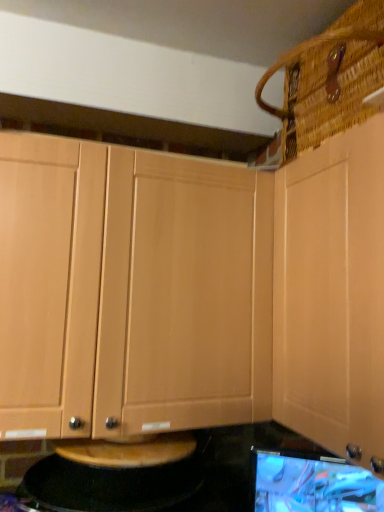
Question: Could you tell me if light wood cabinet at upper right, the second cabinetry viewed from the left, is turned towards light wood cabinet at center, which ranks as the 1th cabinetry in left-to-right order?

Choices:
 (A) no
 (B) yes

Answer: (A)

Question: Considering the relative sizes of light wood cabinet at upper right, which is the first cabinetry in right-to-left order, and light wood cabinet at center, which ranks as the 1th cabinetry in left-to-right order, in the image provided, is light wood cabinet at upper right, which is the first cabinetry in right-to-left order, shorter than light wood cabinet at center, which ranks as the 1th cabinetry in left-to-right order,?

Choices:
 (A) yes
 (B) no

Answer: (B)

Question: Is light wood cabinet at upper right, which is the first cabinetry in right-to-left order, closer to the viewer compared to light wood cabinet at center, which ranks as the 1th cabinetry in left-to-right order?

Choices:
 (A) yes
 (B) no

Answer: (A)

Question: From a real-world perspective, is light wood cabinet at upper right, the second cabinetry viewed from the left, positioned over light wood cabinet at center, which ranks as the 1th cabinetry in left-to-right order, based on gravity?

Choices:
 (A) yes
 (B) no

Answer: (A)

Question: Does light wood cabinet at upper right, which is the first cabinetry in right-to-left order, have a smaller size compared to light wood cabinet at center, which ranks as the 1th cabinetry in left-to-right order?

Choices:
 (A) no
 (B) yes

Answer: (B)

Question: From the image's perspective, is black granite countertop at lower center positioned above or below matte black monitor at lower right?

Choices:
 (A) below
 (B) above

Answer: (B)

Question: In terms of height, does black granite countertop at lower center look taller or shorter compared to matte black monitor at lower right?

Choices:
 (A) short
 (B) tall

Answer: (A)

Question: Considering the positions of point (39, 507) and point (289, 475), is point (39, 507) closer or farther from the camera than point (289, 475)?

Choices:
 (A) closer
 (B) farther

Answer: (A)

Question: Is black granite countertop at lower center in front of or behind matte black monitor at lower right in the image?

Choices:
 (A) behind
 (B) front

Answer: (B)

Question: In terms of width, does light wood cabinet at center, which ranks as the 1th cabinetry in left-to-right order, look wider or thinner when compared to woven brown basket at upper right?

Choices:
 (A) wide
 (B) thin

Answer: (B)

Question: Is light wood cabinet at center, which ranks as the 1th cabinetry in left-to-right order, taller or shorter than woven brown basket at upper right?

Choices:
 (A) short
 (B) tall

Answer: (B)

Question: Is point (135, 254) positioned closer to the camera than point (372, 35)?

Choices:
 (A) closer
 (B) farther

Answer: (B)

Question: In terms of size, does light wood cabinet at center, the second cabinetry in the right-to-left sequence, appear bigger or smaller than woven brown basket at upper right?

Choices:
 (A) big
 (B) small

Answer: (A)

Question: Is light wood cabinet at upper right, the second cabinetry viewed from the left, to the left or to the right of light wood cabinet at center, which ranks as the 1th cabinetry in left-to-right order, in the image?

Choices:
 (A) right
 (B) left

Answer: (A)

Question: From the image's perspective, is light wood cabinet at upper right, which is the first cabinetry in right-to-left order, positioned above or below light wood cabinet at center, the second cabinetry in the right-to-left sequence?

Choices:
 (A) above
 (B) below

Answer: (A)